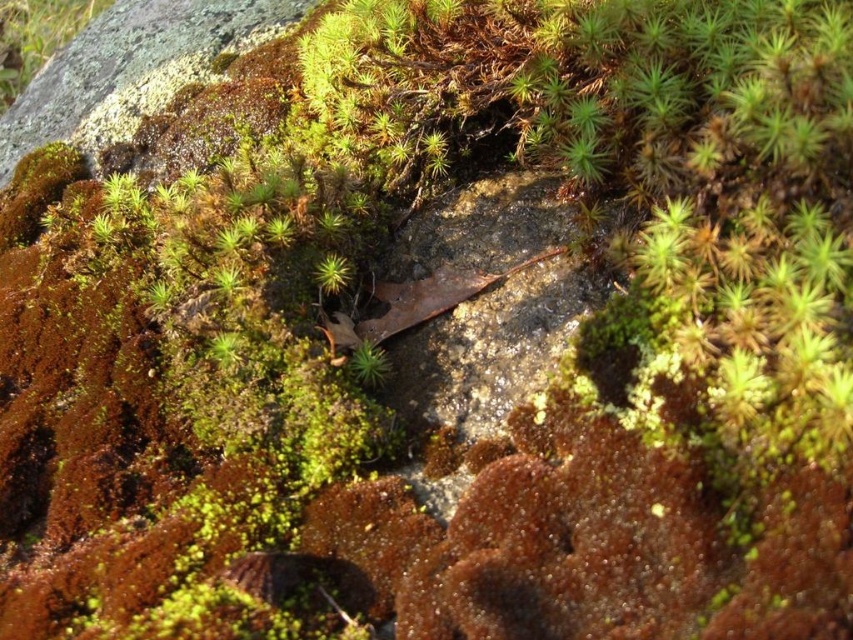
Question: Does green mossy plant at upper left have a smaller size compared to green fuzzy moss at center?

Choices:
 (A) no
 (B) yes

Answer: (A)

Question: Which point is farther to the camera?

Choices:
 (A) green fuzzy moss at center
 (B) green mossy plant at upper left

Answer: (B)

Question: Is green mossy plant at upper left thinner than green fuzzy moss at center?

Choices:
 (A) yes
 (B) no

Answer: (B)

Question: Is green mossy plant at upper left smaller than green fuzzy moss at center?

Choices:
 (A) no
 (B) yes

Answer: (A)

Question: Which point is closer to the camera taking this photo?

Choices:
 (A) (56, 33)
 (B) (372, 369)

Answer: (B)